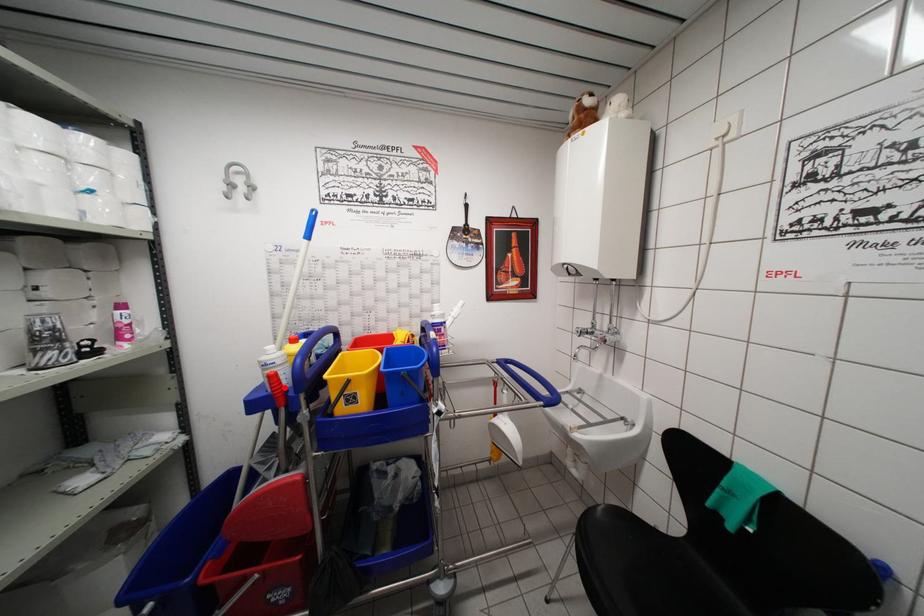
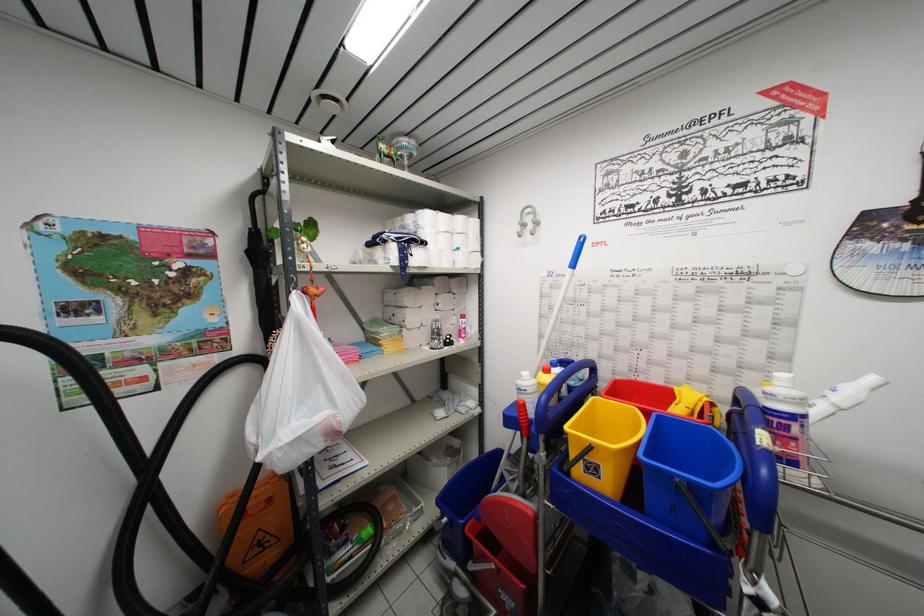
Locate, in the second image, the point that corresponds to the highlighted location in the first image.

(530, 419)